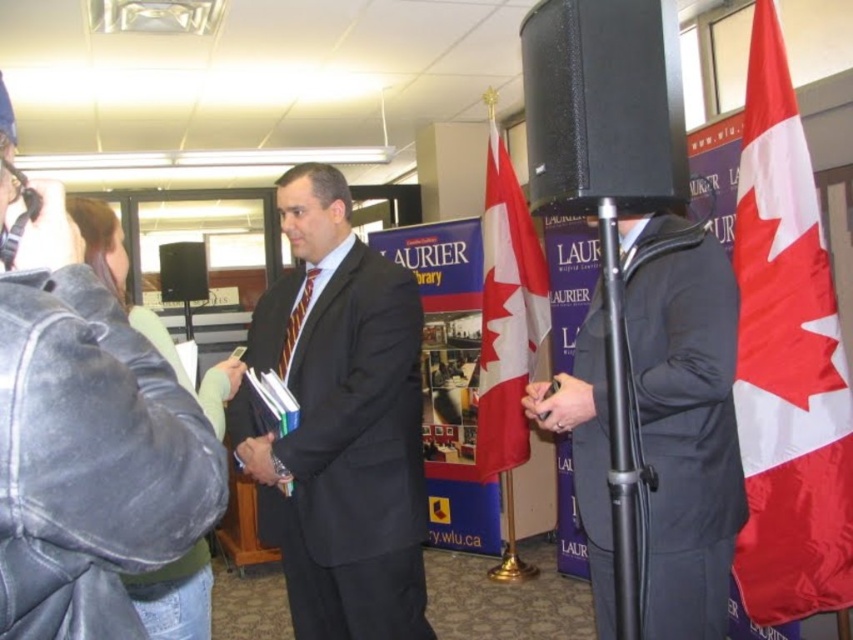
Does red fabric flag at center appear on the right side of denim jacket at left?

Correct, you'll find red fabric flag at center to the right of denim jacket at left.

Which of these two, red fabric flag at center or denim jacket at left, stands shorter?

denim jacket at left is shorter.

You are a GUI agent. You are given a task and a screenshot of the screen. Output one action in this format:
    pyautogui.click(x=<x>, y=<y>)
    Task: Click on the red fabric flag at center
    The width and height of the screenshot is (853, 640).
    Given the screenshot: What is the action you would take?
    pyautogui.click(x=508, y=314)

At what (x,y) coordinates should I click in order to perform the action: click on red fabric flag at center. Please return your answer as a coordinate pair (x, y). The width and height of the screenshot is (853, 640). Looking at the image, I should click on (508, 314).

What do you see at coordinates (340, 422) in the screenshot?
I see `dark suit at center` at bounding box center [340, 422].

I want to click on dark suit at center, so click(340, 422).

Does point (280, 348) come in front of point (190, 275)?

Yes, point (280, 348) is in front of point (190, 275).

Where is `dark suit at center`? The height and width of the screenshot is (640, 853). dark suit at center is located at coordinates (340, 422).

Who is positioned more to the left, dark suit at center or black matte suit at center?

Positioned to the left is dark suit at center.

Describe the element at coordinates (340, 422) in the screenshot. I see `dark suit at center` at that location.

The width and height of the screenshot is (853, 640). Identify the location of dark suit at center. (340, 422).